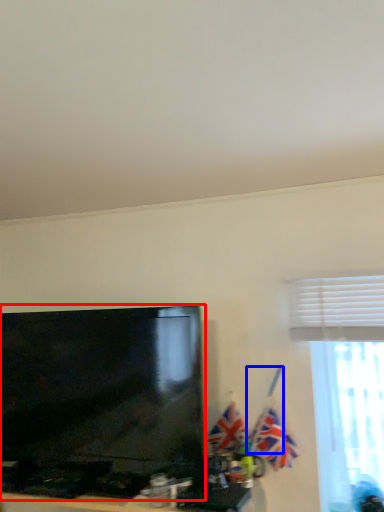
Question: Which of the following is the farthest to the observer, television (highlighted by a red box) or flag pole (highlighted by a blue box)?

Choices:
 (A) television
 (B) flag pole

Answer: (B)